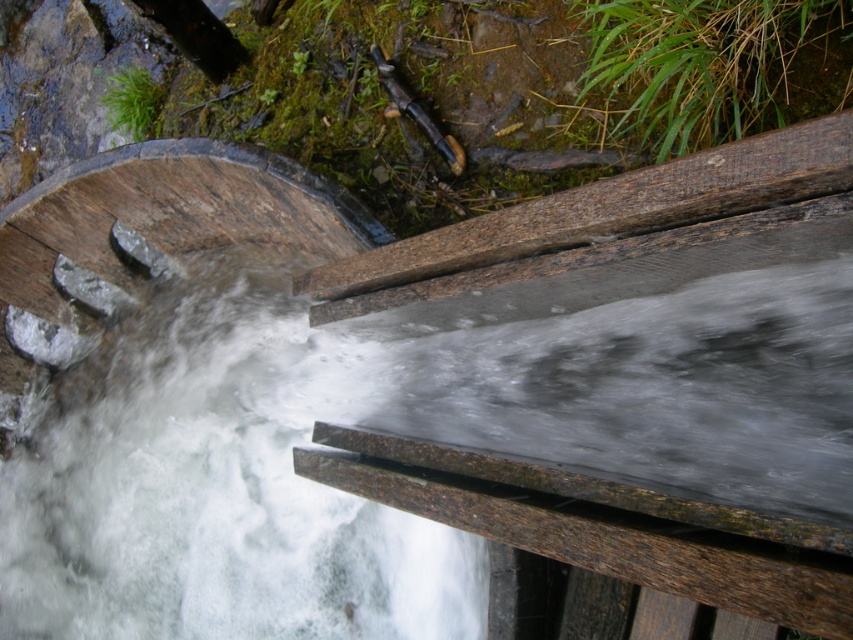
Based on the scene of a waterwheel in operation, which object at the center has a greater width when comparing the clear water at center and the brown wood rail at center?

The clear water at center might be wider than brown wood rail at center according to the description.

You are standing near the waterwheel and want to place a small toy boat in the water. To ensure it floats properly, where should you place it in relation to the clear water at center and the brown wood rail at center?

You should place the small toy boat in the clear water at center, which is located below the brown wood rail at center, ensuring it floats properly in the water.

You are standing in front of the waterwheel and notice two points marked on it. One is at point (224,483) and the other at point (798,124). Which point is closer to you?

Point (224,483) is further to the camera than point (798,124), so the point closer to you is point (798,124).